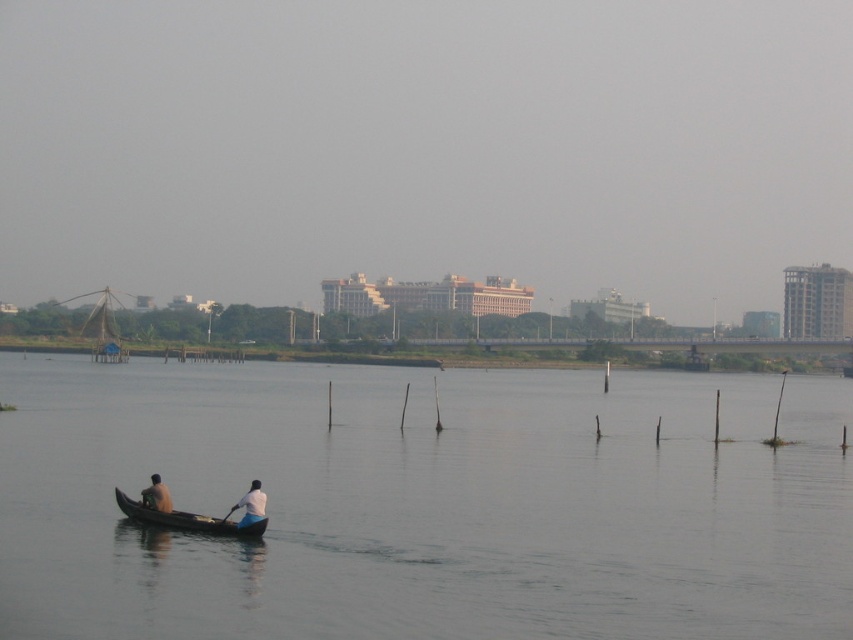
Question: Can you confirm if white fabric shirt at lower center is bigger than skinny man at left?

Choices:
 (A) yes
 (B) no

Answer: (A)

Question: Which point is closer to the camera?

Choices:
 (A) (161, 492)
 (B) (196, 522)
 (C) (228, 512)
 (D) (466, 496)

Answer: (C)

Question: Can you confirm if dark brown wood canoe at lower left is smaller than white plastic paddle at lower center?

Choices:
 (A) yes
 (B) no

Answer: (B)

Question: Among these points, which one is nearest to the camera?

Choices:
 (A) (259, 506)
 (B) (131, 518)
 (C) (234, 515)

Answer: (A)

Question: Among these points, which one is farthest from the camera?

Choices:
 (A) (236, 504)
 (B) (252, 516)
 (C) (166, 488)
 (D) (265, 522)

Answer: (C)

Question: In this image, where is dark brown wood canoe at lower left located relative to white plastic paddle at lower center?

Choices:
 (A) below
 (B) above

Answer: (A)